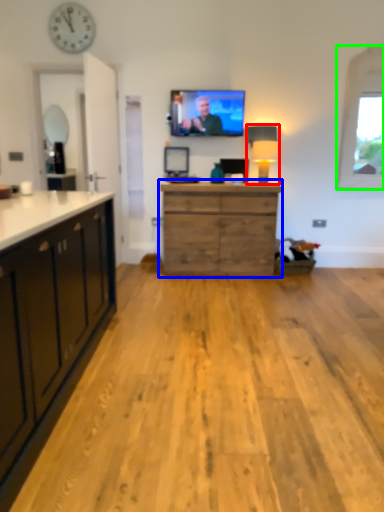
Question: Based on their relative distances, which object is nearer to lamp (highlighted by a red box)? Choose from chest of drawers (highlighted by a blue box) and window (highlighted by a green box).

Choices:
 (A) chest of drawers
 (B) window

Answer: (A)